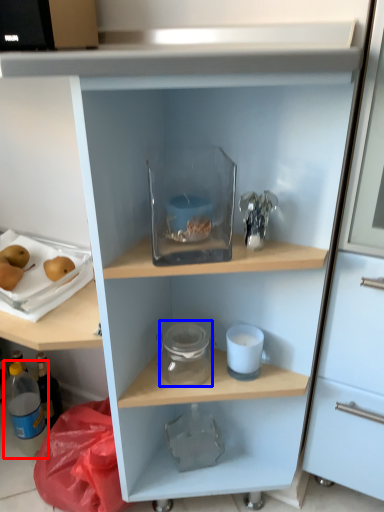
Question: Which object is further to the camera taking this photo, bottle (highlighted by a red box) or glass jar (highlighted by a blue box)?

Choices:
 (A) bottle
 (B) glass jar

Answer: (A)